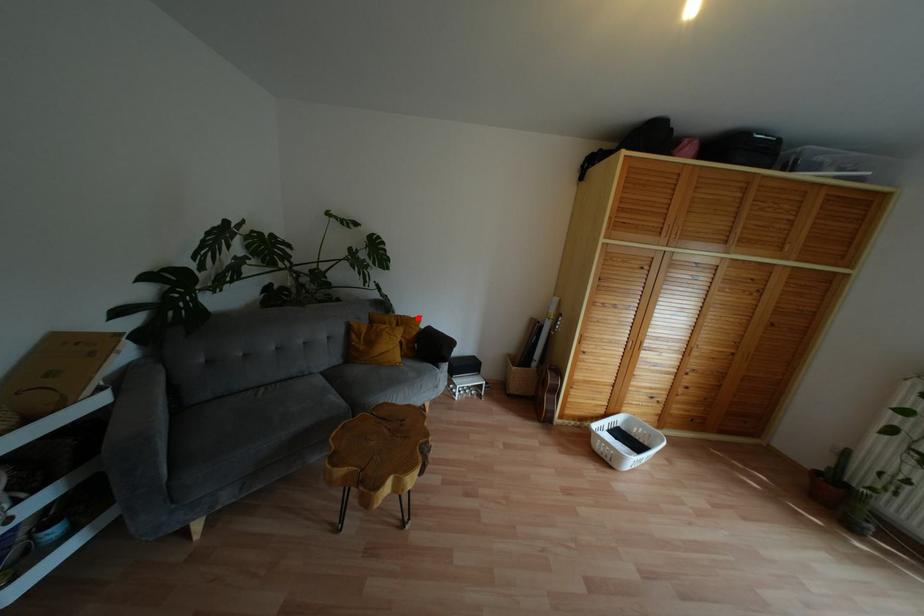
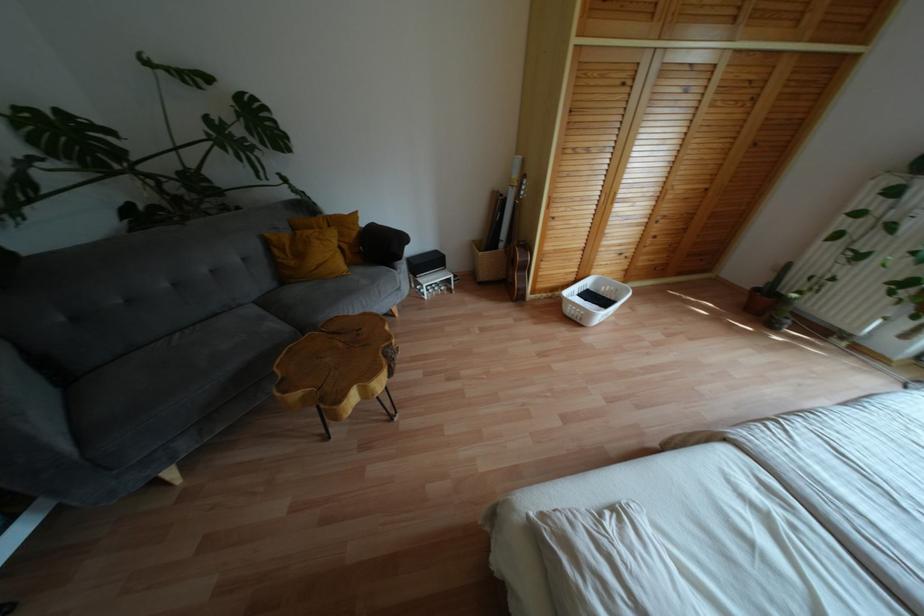
Question: I am providing you with two images of the same scene from different viewpoints. Image1 has a red point marked. In image2, the corresponding 3D location appears at what relative position? Reply with the corresponding letter.

Choices:
 (A) Closer
 (B) Farther

Answer: (A)